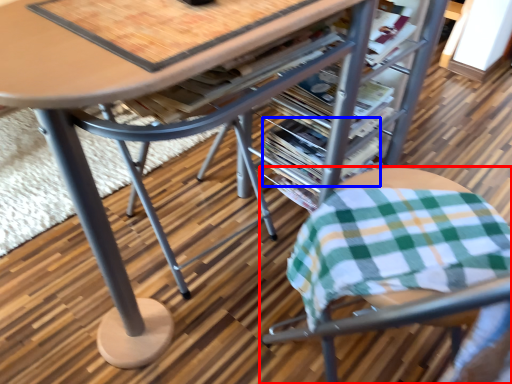
Question: Which object appears closest to the camera in this image, chair (highlighted by a red box) or magazine (highlighted by a blue box)?

Choices:
 (A) chair
 (B) magazine

Answer: (A)